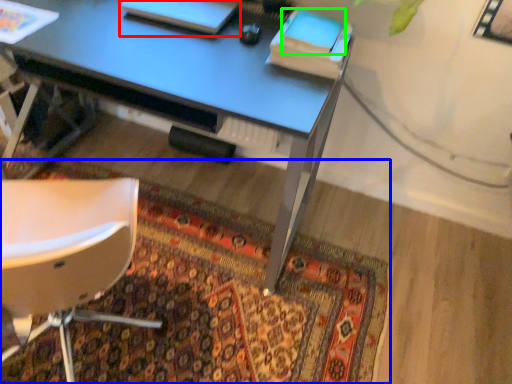
Question: Which is farther away from book (highlighted by a red box)? mat (highlighted by a blue box) or notepad (highlighted by a green box)?

Choices:
 (A) mat
 (B) notepad

Answer: (A)